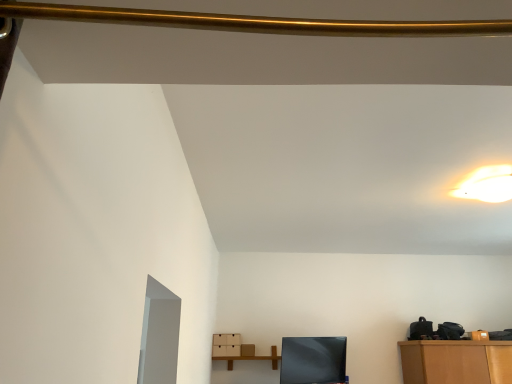
Where is `warm matte light fixture at upper right`? The image size is (512, 384). warm matte light fixture at upper right is located at coordinates (487, 184).

Describe the element at coordinates (487, 184) in the screenshot. I see `warm matte light fixture at upper right` at that location.

Identify the location of warm matte light fixture at upper right. (487, 184).